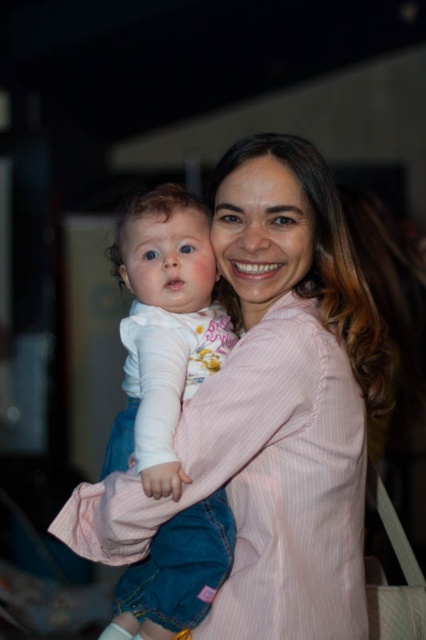
You are a photographer who wants to ensure the baby is visible in the photo. Given the current composition, will the pink striped shirt at center block the view of the white soft fabric baby at center?

The pink striped shirt at center is taller than the white soft fabric baby at center, so it may block part of the baby from view.

You are a photographer adjusting the lighting for a photo shoot. You need to ensure that both the pink striped shirt at center and the white soft fabric baby at center are well lit. Based on their sizes, which object might require a wider light source to cover it adequately?

The pink striped shirt at center might be wider than the white soft fabric baby at center, so it would likely require a wider light source to ensure proper illumination.

You are a photographer adjusting the lighting for a portrait session. You notice the pink striped shirt at center and the white soft fabric baby at center. Which object should you focus on to ensure proper exposure, considering their sizes?

The pink striped shirt at center is larger in size than the white soft fabric baby at center, so you should focus on the pink striped shirt at center for proper exposure since it occupies more of the frame.